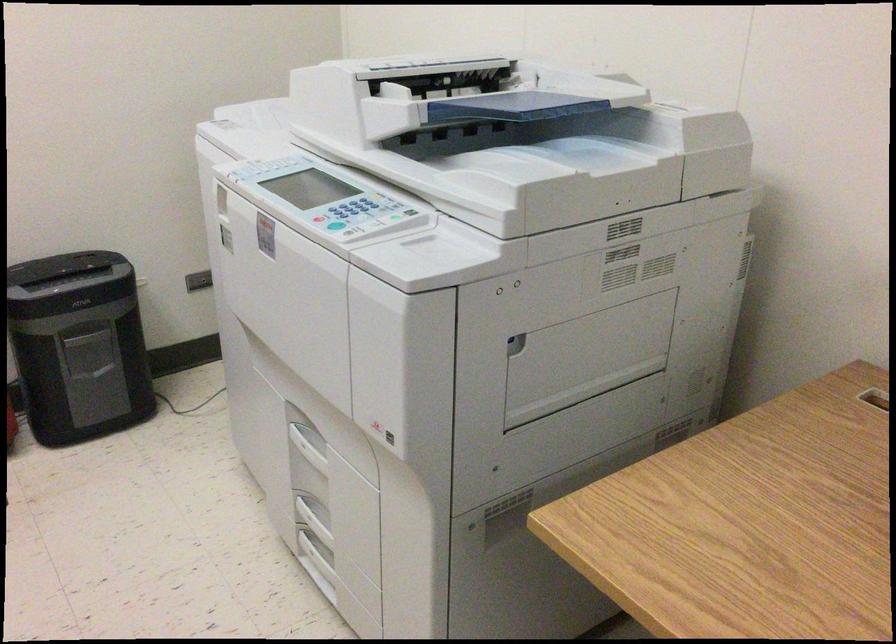
This screenshot has width=896, height=644. I want to click on shredder bin handle, so click(x=79, y=346).